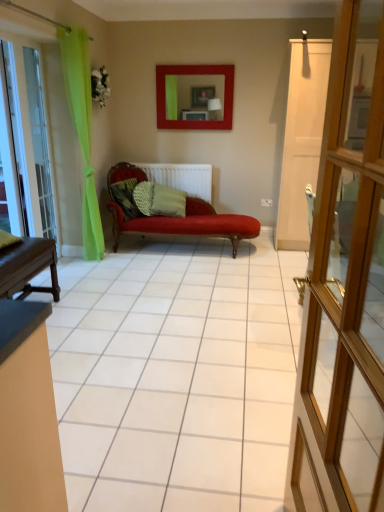
Question: From the image's perspective, does white matte radiator at center appear lower than matte red picture frame at upper center?

Choices:
 (A) no
 (B) yes

Answer: (B)

Question: Considering the relative sizes of white matte radiator at center and matte red picture frame at upper center in the image provided, is white matte radiator at center shorter than matte red picture frame at upper center?

Choices:
 (A) no
 (B) yes

Answer: (B)

Question: Considering the relative sizes of white matte radiator at center and matte red picture frame at upper center in the image provided, is white matte radiator at center smaller than matte red picture frame at upper center?

Choices:
 (A) no
 (B) yes

Answer: (A)

Question: Is white matte radiator at center not within matte red picture frame at upper center?

Choices:
 (A) yes
 (B) no

Answer: (A)

Question: Is white matte radiator at center oriented away from matte red picture frame at upper center?

Choices:
 (A) no
 (B) yes

Answer: (A)

Question: From a real-world perspective, is transparent glass door at left positioned above or below camouflage fabric pillow at center, the 2th pillow positioned from the right?

Choices:
 (A) below
 (B) above

Answer: (B)

Question: From the image's perspective, is transparent glass door at left positioned above or below camouflage fabric pillow at center, which is the first pillow in left-to-right order?

Choices:
 (A) above
 (B) below

Answer: (A)

Question: Relative to camouflage fabric pillow at center, which is the first pillow in left-to-right order, is transparent glass door at left in front or behind?

Choices:
 (A) front
 (B) behind

Answer: (A)

Question: Is transparent glass door at left wider or thinner than camouflage fabric pillow at center, which is the first pillow in left-to-right order?

Choices:
 (A) wide
 (B) thin

Answer: (B)

Question: Considering the positions of white matte radiator at center and green textured pillow at center, which is counted as the 1th pillow, starting from the right, in the image, is white matte radiator at center bigger or smaller than green textured pillow at center, which is counted as the 1th pillow, starting from the right,?

Choices:
 (A) big
 (B) small

Answer: (B)

Question: From the image's perspective, is white matte radiator at center located above or below green textured pillow at center, the 2th pillow viewed from the left?

Choices:
 (A) below
 (B) above

Answer: (B)

Question: Is white matte radiator at center inside the boundaries of green textured pillow at center, which is counted as the 1th pillow, starting from the right, or outside?

Choices:
 (A) inside
 (B) outside

Answer: (B)

Question: Is point pos(157,168) closer or farther from the camera than point pos(157,187)?

Choices:
 (A) closer
 (B) farther

Answer: (B)

Question: Based on their positions, is clear glass door at left located to the left or right of white wooden door at center?

Choices:
 (A) right
 (B) left

Answer: (B)

Question: From the image's perspective, relative to white wooden door at center, is clear glass door at left above or below?

Choices:
 (A) above
 (B) below

Answer: (A)